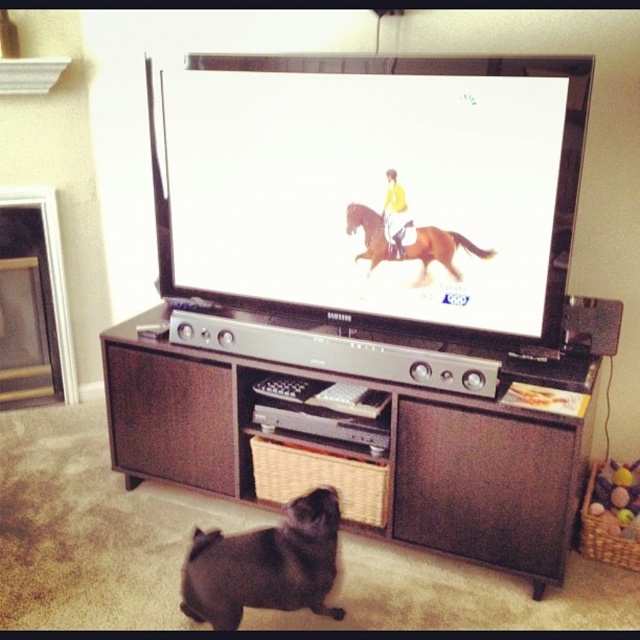
Which is in front, point (564, 515) or point (244, 570)?

Positioned in front is point (244, 570).

Can you confirm if brown wood entertainment center at center is positioned above black matte dog at lower center?

Correct, brown wood entertainment center at center is located above black matte dog at lower center.

The height and width of the screenshot is (640, 640). I want to click on brown wood entertainment center at center, so click(x=388, y=449).

The height and width of the screenshot is (640, 640). I want to click on white glossy screen at center, so click(x=372, y=189).

Which is more to the left, white glossy screen at center or brown glossy horse at center?

white glossy screen at center

Identify the location of white glossy screen at center. This screenshot has width=640, height=640. (372, 189).

Between white glossy screen at center and black matte dog at lower center, which one has less height?

With less height is black matte dog at lower center.

Consider the image. Who is positioned more to the left, white glossy screen at center or black matte dog at lower center?

black matte dog at lower center is more to the left.

Is point (280, 259) farther from camera compared to point (266, 538)?

That is True.

This screenshot has height=640, width=640. I want to click on white glossy screen at center, so click(372, 189).